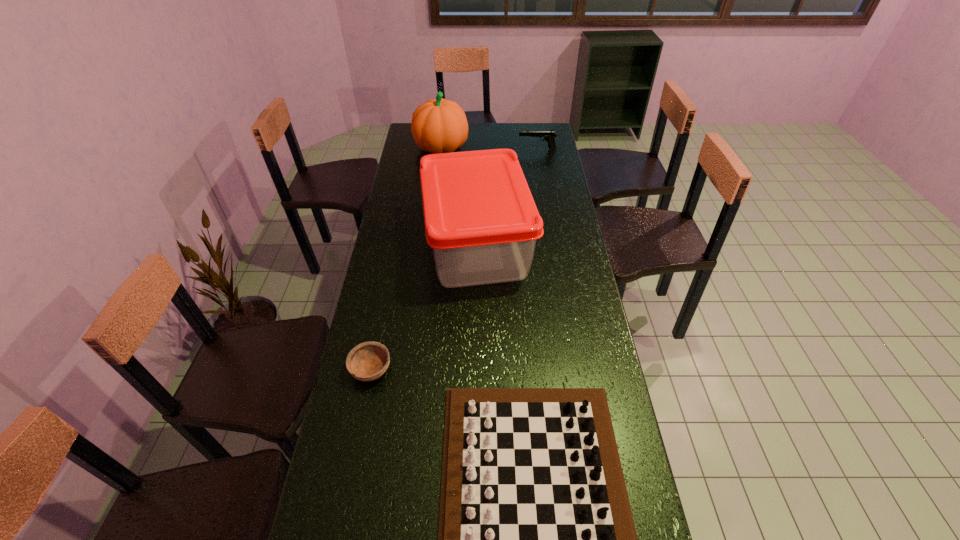
The image size is (960, 540). I want to click on pumpkin, so point(438,126).

Image resolution: width=960 pixels, height=540 pixels. Identify the location of the third farthest object. (481, 221).

Find the location of a particular element. the third shortest object is located at coordinates (549, 136).

At what (x,y) coordinates should I click in order to perform the action: click on the second nearest object. Please return your answer as a coordinate pair (x, y). Image resolution: width=960 pixels, height=540 pixels. Looking at the image, I should click on (368, 361).

Image resolution: width=960 pixels, height=540 pixels. What are the coordinates of `the shortest object` in the screenshot? It's located at (368, 361).

This screenshot has height=540, width=960. I want to click on free space located on the front of the pumpkin, so click(x=436, y=195).

Locate an element on the screen. Image resolution: width=960 pixels, height=540 pixels. free location located on the back of the tray is located at coordinates (477, 163).

Where is `vacant space located 0.090m at the aiming end of the third shortest object`? vacant space located 0.090m at the aiming end of the third shortest object is located at coordinates (500, 149).

The image size is (960, 540). I want to click on free space located at the aiming end of the third shortest object, so (x=478, y=149).

Where is `vacant space located at the aiming end of the third shortest object`? This screenshot has height=540, width=960. vacant space located at the aiming end of the third shortest object is located at coordinates (446, 149).